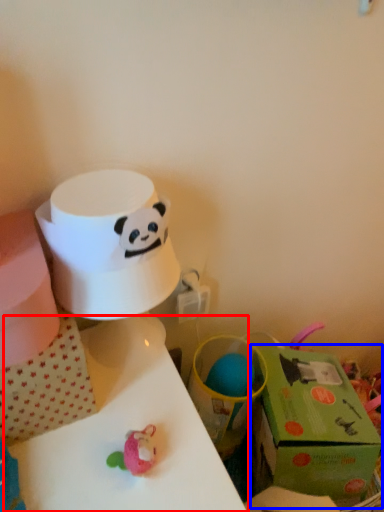
Question: Among these objects, which one is farthest to the camera, table (highlighted by a red box) or gift box (highlighted by a blue box)?

Choices:
 (A) table
 (B) gift box

Answer: (B)